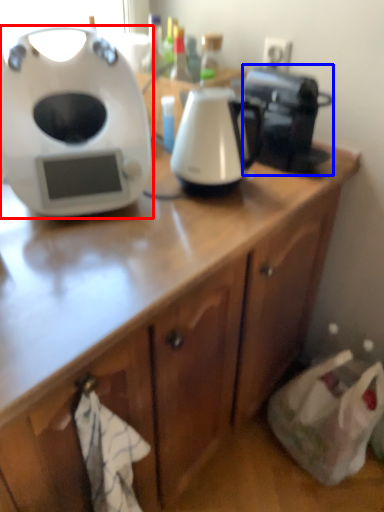
Question: Which point is closer to the camera, home appliance (highlighted by a red box) or coffee maker (highlighted by a blue box)?

Choices:
 (A) home appliance
 (B) coffee maker

Answer: (A)